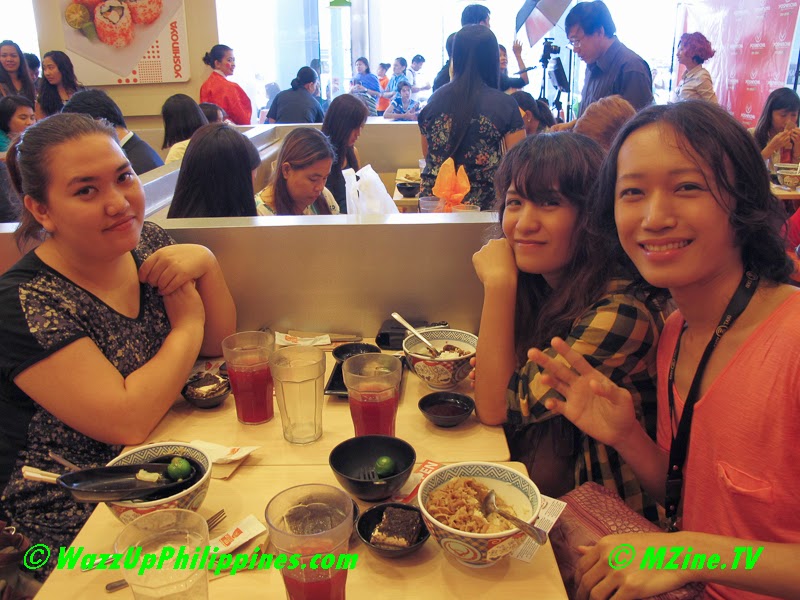
In order to click on utensils in this screenshot , I will do `click(488, 499)`, `click(414, 332)`, `click(54, 453)`, `click(42, 476)`.